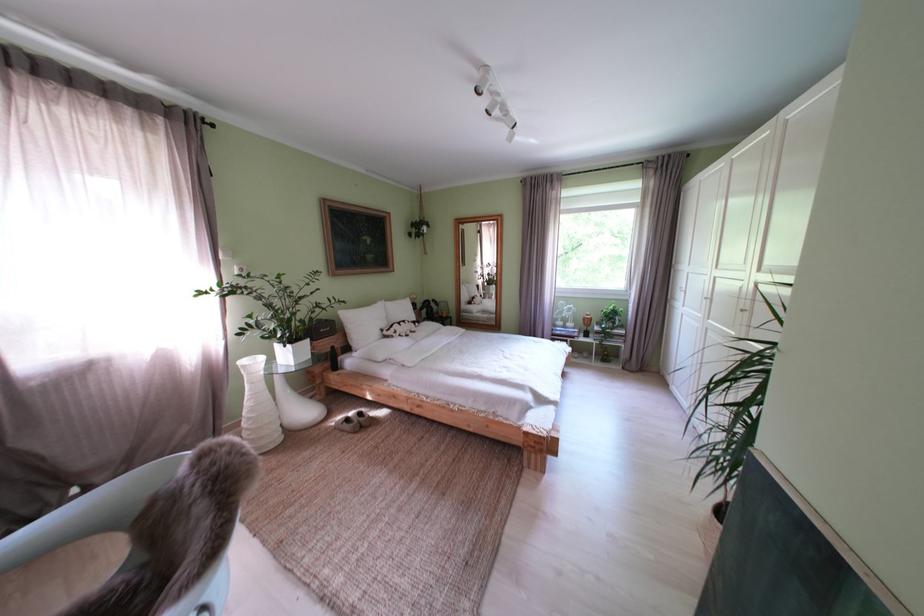
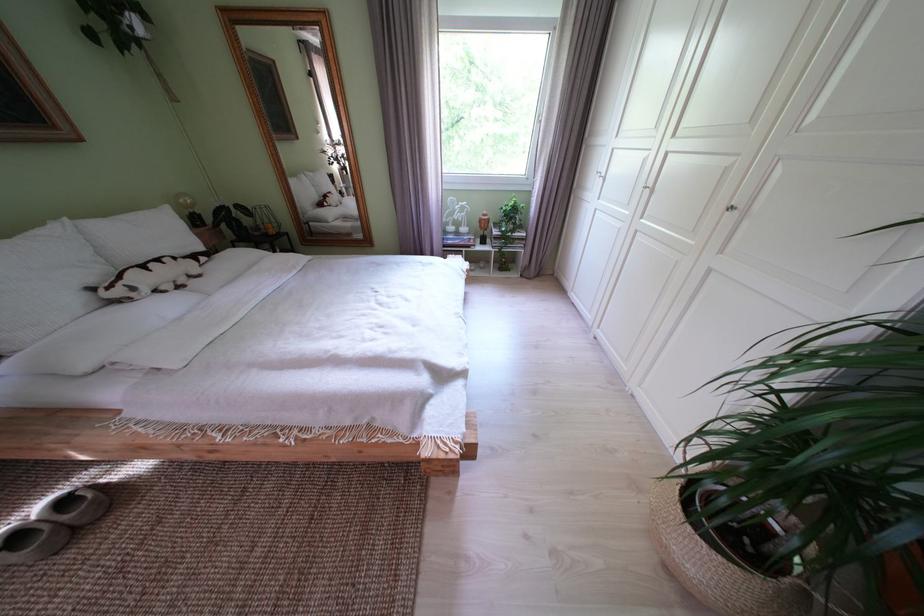
Locate, in the second image, the point that corresponds to pixel 359 424 in the first image.

(28, 543)